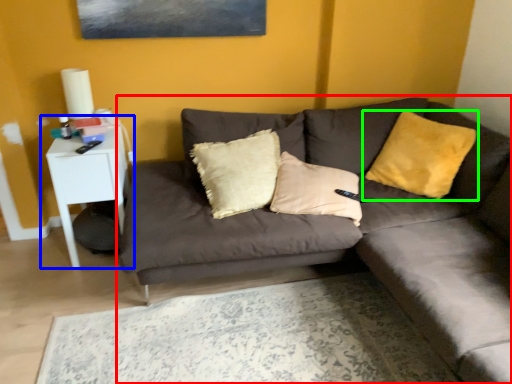
Question: Which object is the closest to the studio couch (highlighted by a red box)? Choose among these: table (highlighted by a blue box) or pillow (highlighted by a green box).

Choices:
 (A) table
 (B) pillow

Answer: (B)